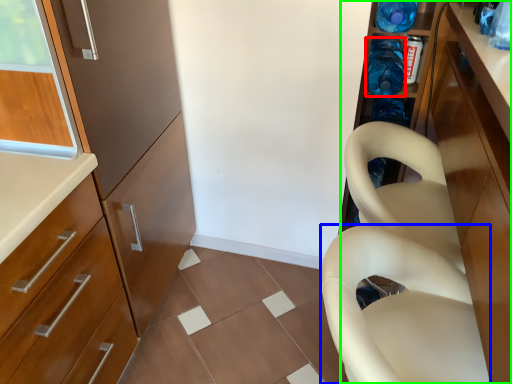
Question: Which object is positioned closest to bottle (highlighted by a red box)? Select from feeding chair (highlighted by a blue box) and cabinetry (highlighted by a green box).

Choices:
 (A) feeding chair
 (B) cabinetry

Answer: (B)